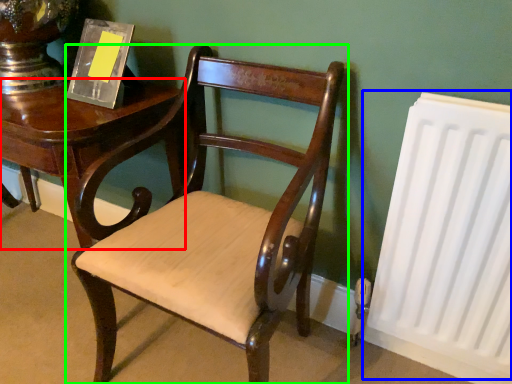
Question: Which is nearer to the table (highlighted by a red box)? radiator (highlighted by a blue box) or chair (highlighted by a green box).

Choices:
 (A) radiator
 (B) chair

Answer: (B)